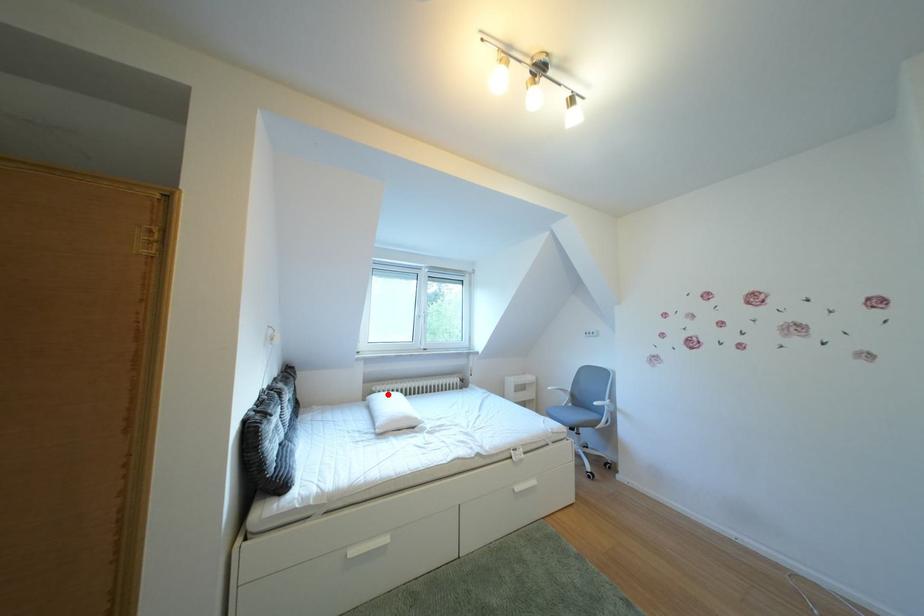
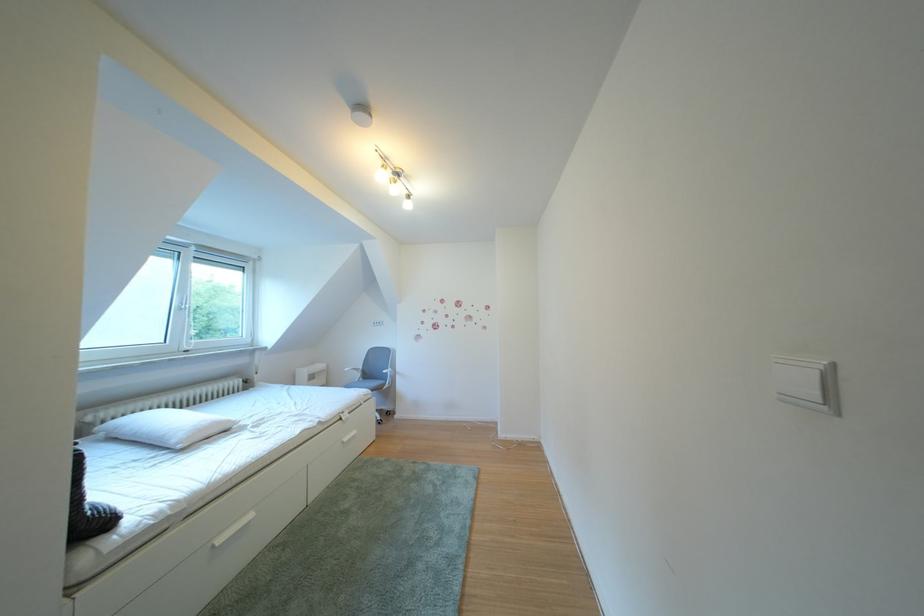
Locate, in the second image, the point that corresponds to the highlighted location in the first image.

(103, 424)